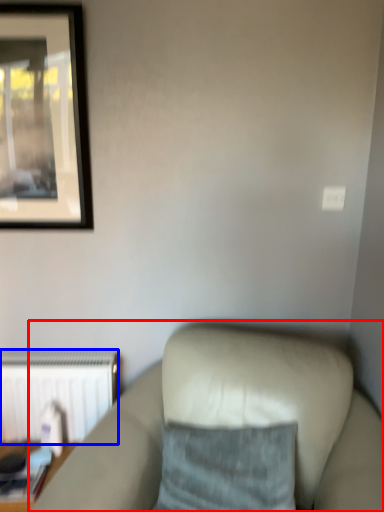
Question: Which point is closer to the camera, studio couch (highlighted by a red box) or radiator (highlighted by a blue box)?

Choices:
 (A) studio couch
 (B) radiator

Answer: (A)